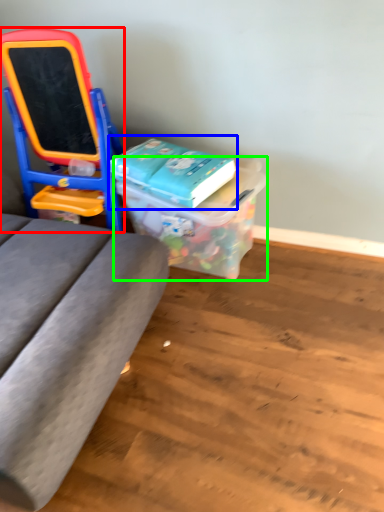
Question: Which object is the farthest from furniture (highlighted by a red box)? Choose among these: book (highlighted by a blue box) or box (highlighted by a green box).

Choices:
 (A) book
 (B) box

Answer: (B)